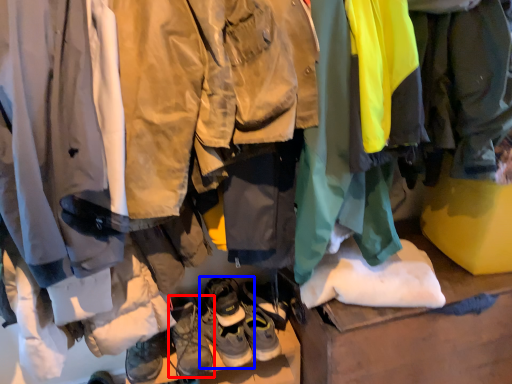
Question: Which object appears closest to the camera in this image, footwear (highlighted by a red box) or footwear (highlighted by a blue box)?

Choices:
 (A) footwear
 (B) footwear

Answer: (A)